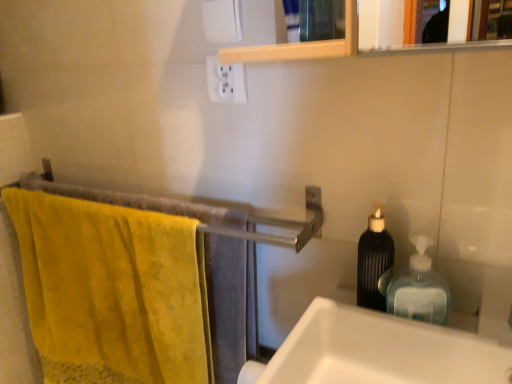
Question: Choose the correct answer: Is white glossy sink at right inside translucent plastic soap dispenser at right, placed as the 2th bottle when sorted from left to right, or outside it?

Choices:
 (A) outside
 (B) inside

Answer: (A)

Question: From a real-world perspective, is white glossy sink at right positioned above or below translucent plastic soap dispenser at right, placed as the 2th bottle when sorted from left to right?

Choices:
 (A) below
 (B) above

Answer: (A)

Question: Estimate the real-world distances between objects in this image. Which object is closer to the white matte toilet paper at upper center?

Choices:
 (A) black textured bottle at right, the 2th bottle from the right
 (B) white plastic outlet at upper center
 (C) translucent plastic soap dispenser at right, placed as the 2th bottle when sorted from left to right
 (D) yellow cotton towel at left
 (E) white glossy sink at right

Answer: (B)

Question: Which object is positioned closest to the translucent plastic soap dispenser at right, arranged as the first bottle when viewed from the right?

Choices:
 (A) white matte toilet paper at upper center
 (B) white plastic outlet at upper center
 (C) white glossy sink at right
 (D) black textured bottle at right, the 1th bottle positioned from the left
 (E) yellow cotton towel at left

Answer: (D)